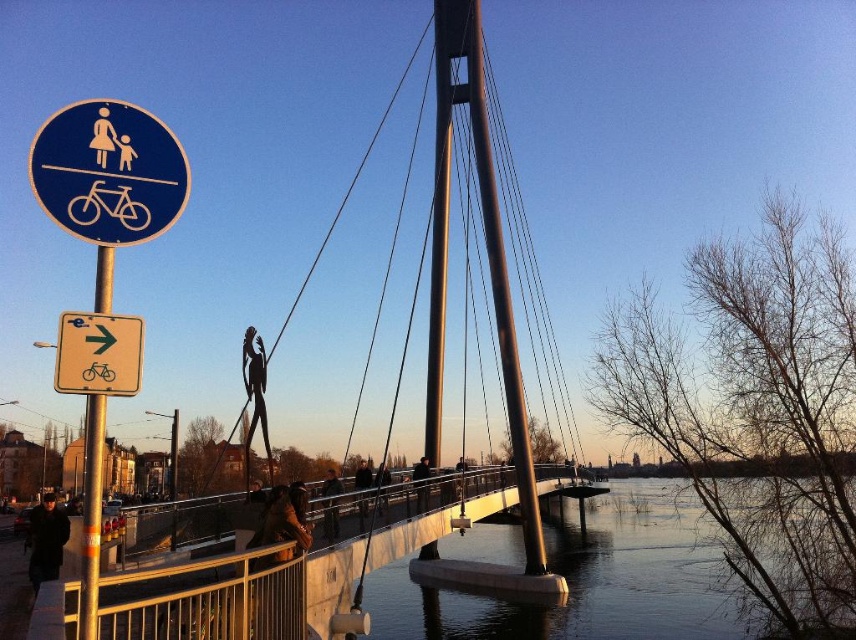
You are standing on the bridge and see two points marked on the ground. The first point is at coordinate point (x=278, y=531) and the second is at point (x=325, y=500). If you are facing the direction of the bridge, which point is closer to you?

Point (x=278, y=531) is in front of point (x=325, y=500), so the first point is closer to you.

You are standing on the bridge and see the brown leather jacket at center. If you want to pick it up, which direction should you move relative to the circular blue sign with white symbols?

The brown leather jacket at center is located at point (287, 524). Since the circular blue sign is in the foreground, you should move towards the center of the bridge to reach it.

You are a cyclist approaching the yellow plastic bicycle at left on the shared path indicated by the circular sign. To reach the metallic gray bridge at center, should you go straight or turn?

The metallic gray bridge at center is located below the yellow plastic bicycle at left, so you should go straight towards the bridge since it is directly ahead in your path.